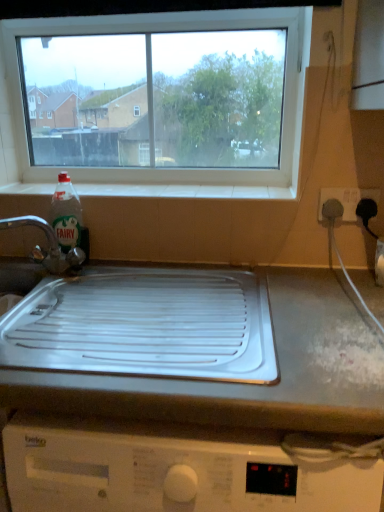
Question: Is white plastic socket at right to the right of clear plastic bottle at left from the viewer's perspective?

Choices:
 (A) no
 (B) yes

Answer: (B)

Question: From the image's perspective, is white plastic socket at right on clear plastic bottle at left?

Choices:
 (A) no
 (B) yes

Answer: (B)

Question: Can you confirm if white plastic socket at right is wider than clear plastic bottle at left?

Choices:
 (A) yes
 (B) no

Answer: (B)

Question: From the image's perspective, would you say white plastic socket at right is shown under clear plastic bottle at left?

Choices:
 (A) yes
 (B) no

Answer: (B)

Question: Is white plastic socket at right smaller than clear plastic bottle at left?

Choices:
 (A) no
 (B) yes

Answer: (B)

Question: From a real-world perspective, is white plastic socket at right physically above clear plastic bottle at left?

Choices:
 (A) no
 (B) yes

Answer: (B)

Question: Is white tile at upper center facing towards white plastic tray at center?

Choices:
 (A) no
 (B) yes

Answer: (A)

Question: From a real-world perspective, is white tile at upper center located beneath white plastic tray at center?

Choices:
 (A) no
 (B) yes

Answer: (A)

Question: From the image's perspective, does white tile at upper center appear lower than white plastic tray at center?

Choices:
 (A) no
 (B) yes

Answer: (A)

Question: Considering the relative positions of white tile at upper center and white plastic tray at center in the image provided, is white tile at upper center behind white plastic tray at center?

Choices:
 (A) yes
 (B) no

Answer: (A)

Question: Is white tile at upper center to the left of white plastic tray at center from the viewer's perspective?

Choices:
 (A) no
 (B) yes

Answer: (B)

Question: Is white tile at upper center placed right next to white plastic tray at center?

Choices:
 (A) yes
 (B) no

Answer: (B)

Question: Considering the relative sizes of white plastic socket at right and brushed metal tap at left in the image provided, is white plastic socket at right shorter than brushed metal tap at left?

Choices:
 (A) yes
 (B) no

Answer: (A)